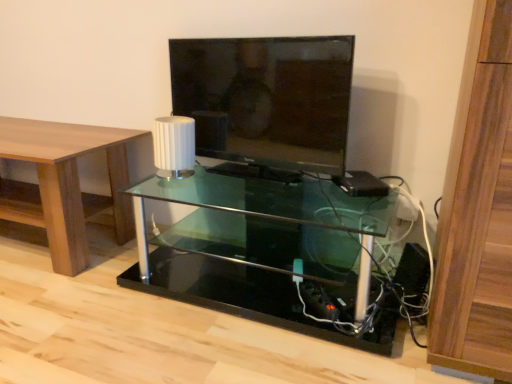
Question: From the image's perspective, does black plastic speaker at lower right appear lower than transparent glass shelf at center?

Choices:
 (A) yes
 (B) no

Answer: (A)

Question: Does black plastic speaker at lower right have a lesser height compared to transparent glass shelf at center?

Choices:
 (A) no
 (B) yes

Answer: (B)

Question: Considering the relative positions of black plastic speaker at lower right and transparent glass shelf at center in the image provided, is black plastic speaker at lower right in front of transparent glass shelf at center?

Choices:
 (A) no
 (B) yes

Answer: (A)

Question: From a real-world perspective, is black plastic speaker at lower right over transparent glass shelf at center?

Choices:
 (A) no
 (B) yes

Answer: (A)

Question: Can you confirm if black plastic speaker at lower right is wider than transparent glass shelf at center?

Choices:
 (A) no
 (B) yes

Answer: (A)

Question: Is black plastic speaker at lower right to the left of transparent glass shelf at center from the viewer's perspective?

Choices:
 (A) yes
 (B) no

Answer: (B)

Question: Would you say white matte lamp at center is a long distance from black plastic speaker at lower right?

Choices:
 (A) no
 (B) yes

Answer: (A)

Question: Is white matte lamp at center thinner than black plastic speaker at lower right?

Choices:
 (A) yes
 (B) no

Answer: (B)

Question: Does white matte lamp at center have a larger size compared to black plastic speaker at lower right?

Choices:
 (A) yes
 (B) no

Answer: (A)

Question: Considering the relative sizes of white matte lamp at center and black plastic speaker at lower right in the image provided, is white matte lamp at center wider than black plastic speaker at lower right?

Choices:
 (A) yes
 (B) no

Answer: (A)

Question: Is the depth of white matte lamp at center greater than that of black plastic speaker at lower right?

Choices:
 (A) no
 (B) yes

Answer: (B)

Question: Considering the relative sizes of white matte lamp at center and black plastic speaker at lower right in the image provided, is white matte lamp at center smaller than black plastic speaker at lower right?

Choices:
 (A) yes
 (B) no

Answer: (B)

Question: Can white matte lamp at center be found inside transparent glass shelf at center?

Choices:
 (A) yes
 (B) no

Answer: (B)